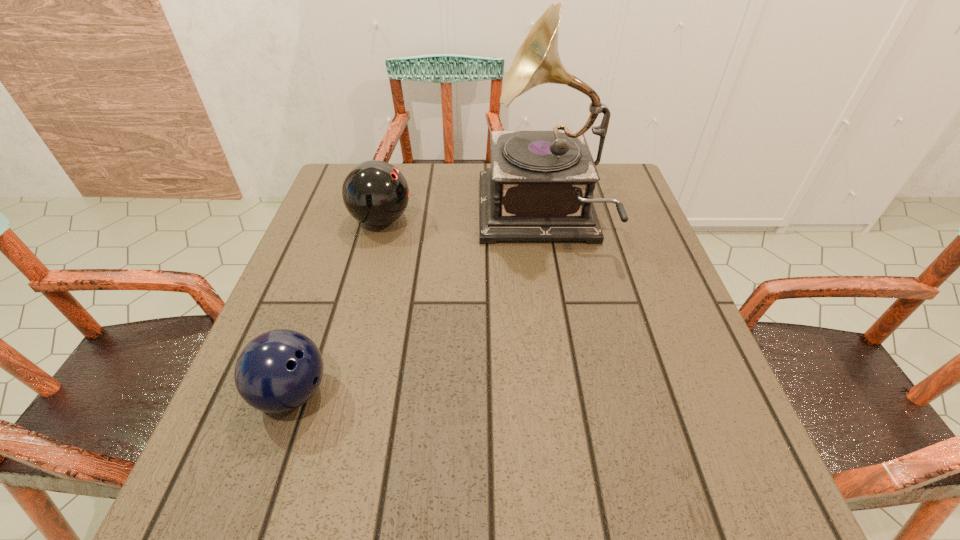
At what (x,y) coordinates should I click in order to perform the action: click on the tallest object. Please return your answer as a coordinate pair (x, y). This screenshot has height=540, width=960. Looking at the image, I should click on (540, 186).

You are a GUI agent. You are given a task and a screenshot of the screen. Output one action in this format:
    pyautogui.click(x=<x>, y=<y>)
    Task: Click on the record player
    Image resolution: width=960 pixels, height=540 pixels.
    Given the screenshot: What is the action you would take?
    pyautogui.click(x=540, y=186)

Where is `the second shortest object`? This screenshot has height=540, width=960. the second shortest object is located at coordinates (375, 193).

Where is `the taller bowling ball`? the taller bowling ball is located at coordinates (375, 193).

The height and width of the screenshot is (540, 960). What are the coordinates of `the nearest object` in the screenshot? It's located at click(x=278, y=371).

The width and height of the screenshot is (960, 540). In order to click on the shorter bowling ball in this screenshot , I will do `click(278, 371)`.

I want to click on free location located 0.370m on the horn of the rightmost object, so click(x=332, y=217).

Find the location of `vacant space situated 0.240m on the horn of the rightmost object`. vacant space situated 0.240m on the horn of the rightmost object is located at coordinates (384, 217).

Image resolution: width=960 pixels, height=540 pixels. I want to click on vacant space located 0.080m on the horn of the rightmost object, so click(x=447, y=217).

This screenshot has width=960, height=540. In order to click on vacant area situated 0.370m on the surface of the second shortest object near the finger holes in this screenshot , I will do `click(561, 220)`.